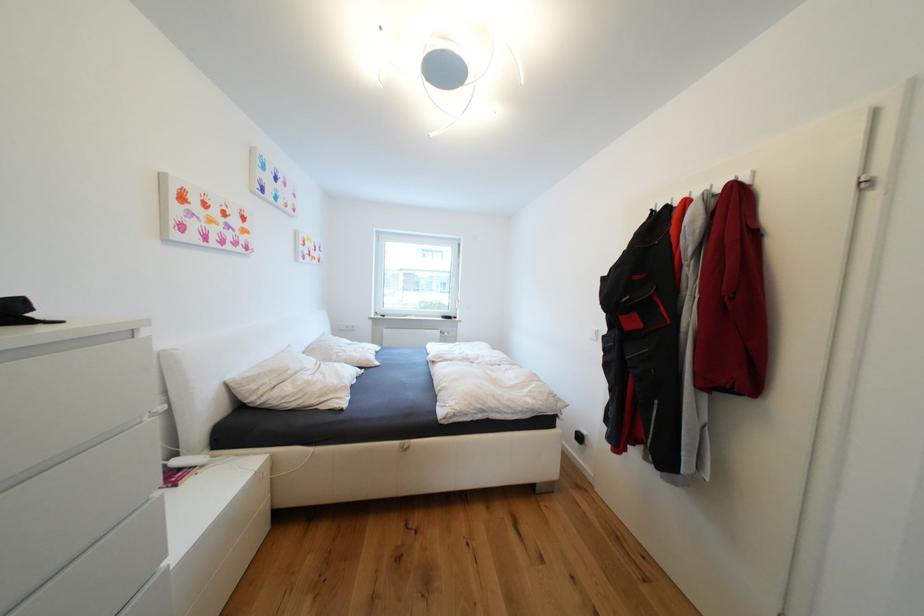
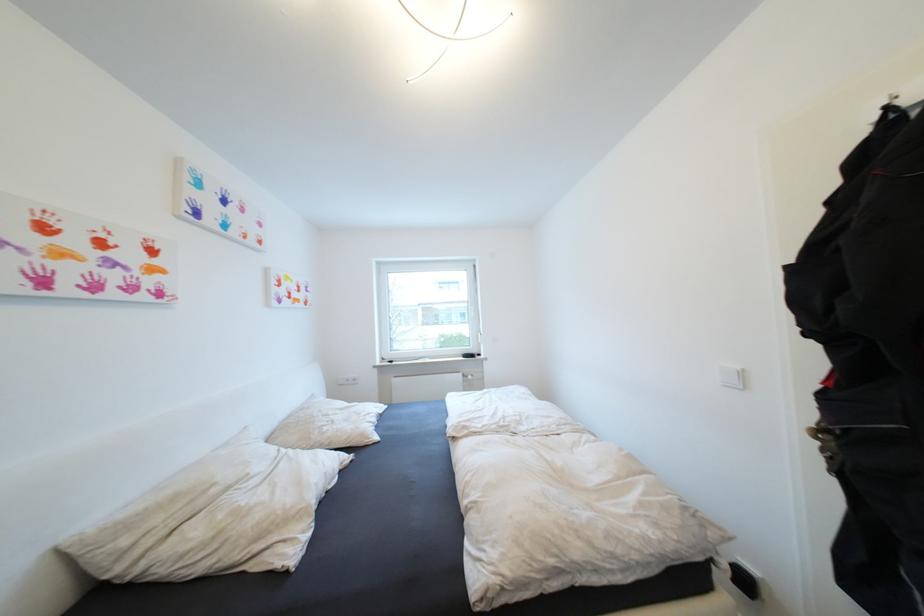
Question: Which direction would the cameraman need to move to produce the second image? Reply with the corresponding letter.

Choices:
 (A) Left
 (B) Right
 (C) Forward
 (D) Backward

Answer: (C)